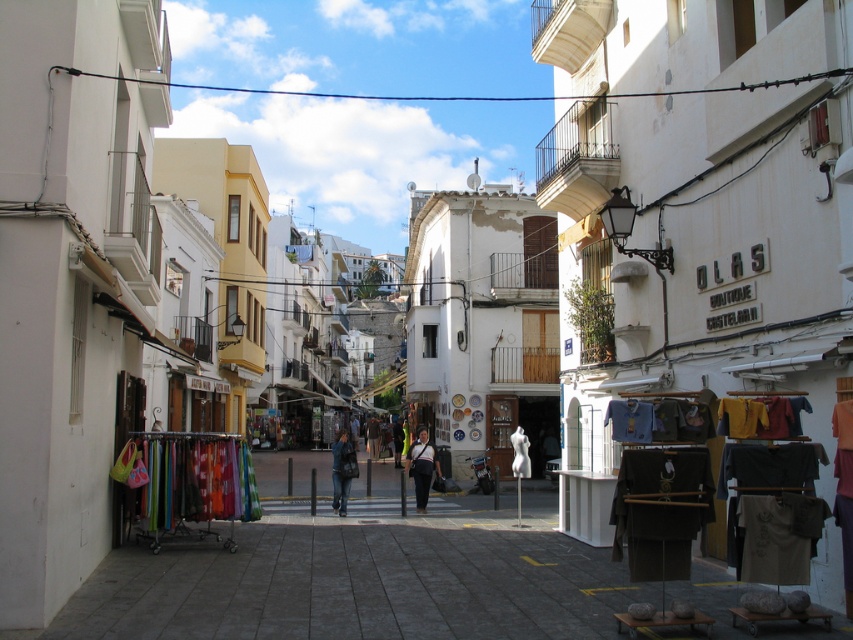
Question: Considering the real-world distances, which object is closest to the light brown leather jacket at center?

Choices:
 (A) textured cotton shirts at right
 (B) dark blue jeans at center
 (C) denim jeans at center

Answer: (C)

Question: Which of these objects is positioned closest to the light brown leather jacket at center?

Choices:
 (A) textured cotton shirts at right
 (B) denim jeans at center
 (C) dark blue jeans at center

Answer: (B)

Question: Where is light brown leather jacket at center located in relation to dark blue jeans at center in the image?

Choices:
 (A) above
 (B) below

Answer: (A)

Question: Which object is positioned farthest from the light brown leather jacket at center?

Choices:
 (A) textured cotton shirts at right
 (B) dark blue jeans at center
 (C) denim jeans at center

Answer: (B)

Question: Is the position of denim jeans at center more distant than that of dark blue jeans at center?

Choices:
 (A) no
 (B) yes

Answer: (A)

Question: Does textured cotton shirts at right have a larger size compared to denim jeans at center?

Choices:
 (A) no
 (B) yes

Answer: (A)